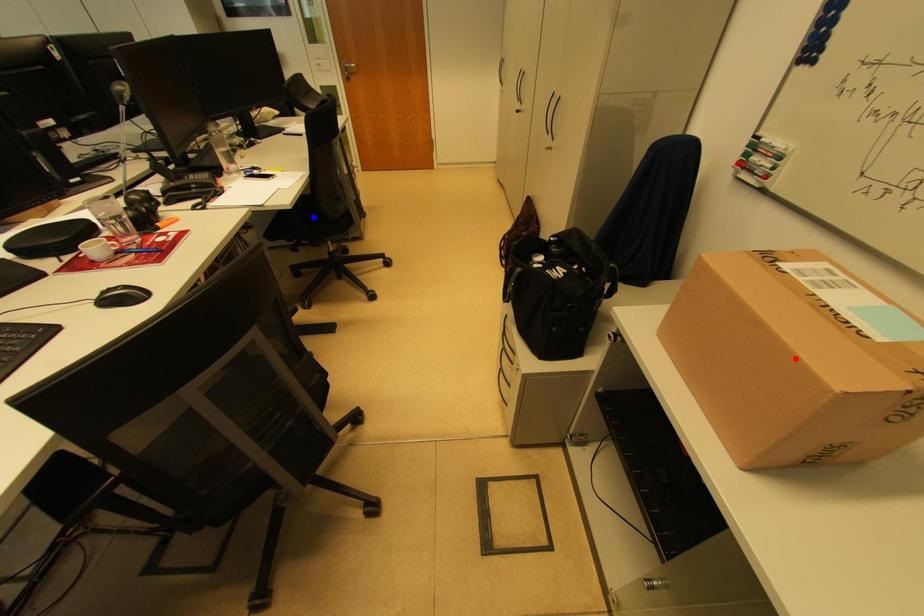
Question: Two points are marked on the image. Which point is closer to the camera?

Choices:
 (A) Blue point is closer.
 (B) Red point is closer.

Answer: (B)